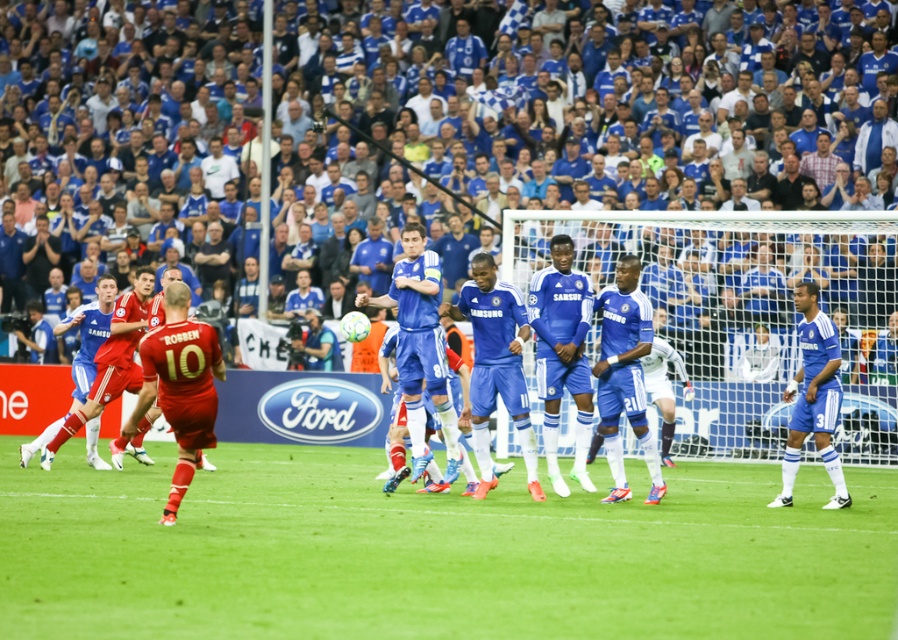
You are a soccer coach analyzing the field layout. The green grass at center and the blue matte jersey at right are both visible in the image. Which object occupies more horizontal space in the image?

The green grass at center occupies more horizontal space than the blue matte jersey at right because its width is larger, as stated in the description.

You are a soccer player trying to score a goal. You notice the blue jersey crowd at upper center. Based on their position, which direction should you aim the ball to avoid them?

The blue jersey crowd at upper center is located at point (755, 291). To avoid them, aim the ball in the opposite direction, such as towards the lower left corner of the goal.